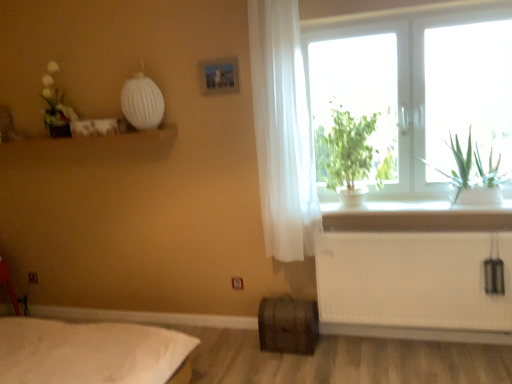
Find the location of a particular element. The height and width of the screenshot is (384, 512). vacant region above white glass window at upper right (from a real-world perspective) is located at coordinates (408, 15).